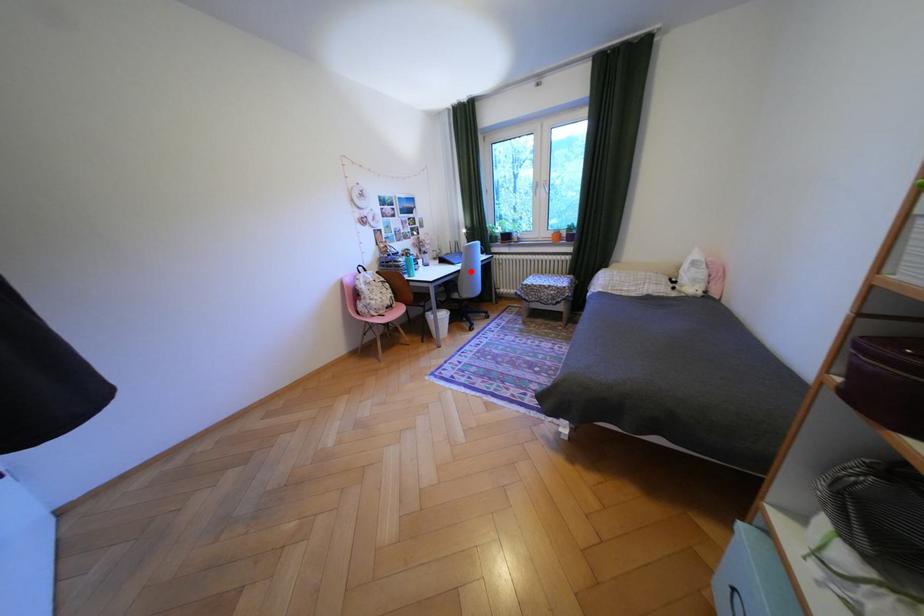
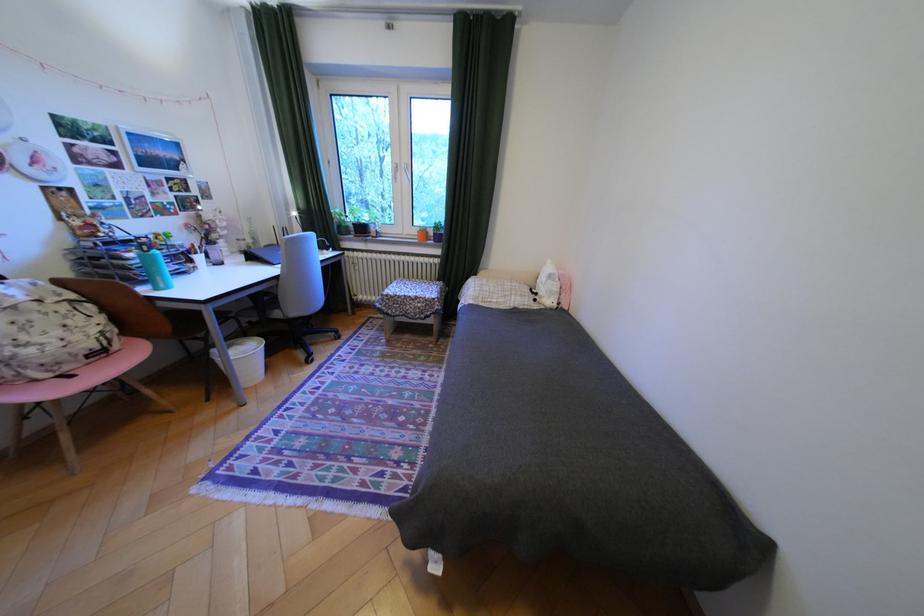
Locate, in the second image, the point that corresponds to the highlighted location in the first image.

(288, 278)